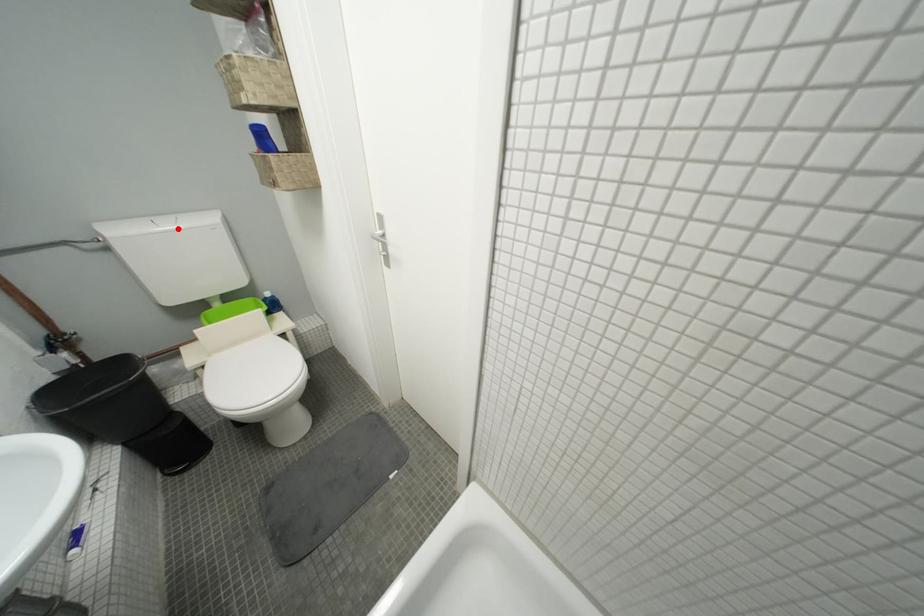
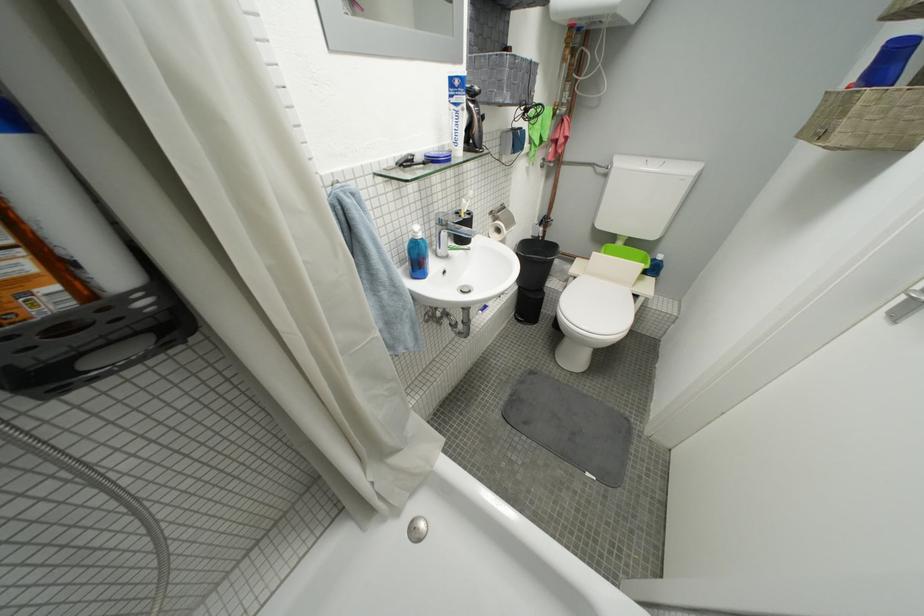
Locate, in the second image, the point that corresponds to the highlighted location in the first image.

(662, 169)